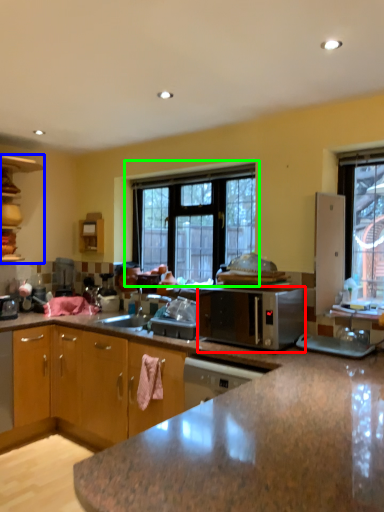
Question: Based on their relative distances, which object is farther from microwave oven (highlighted by a red box)? Choose from cabinetry (highlighted by a blue box) and window (highlighted by a green box).

Choices:
 (A) cabinetry
 (B) window

Answer: (A)